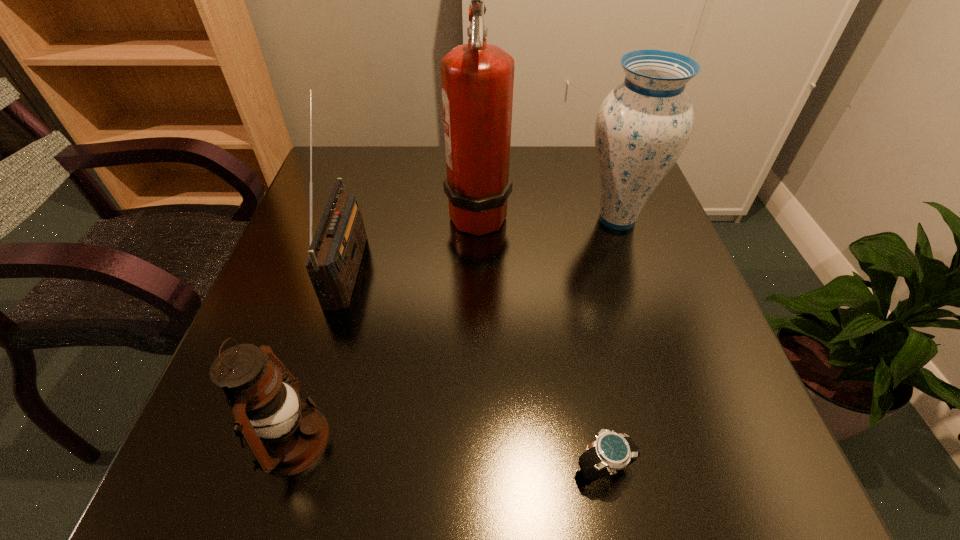
The image size is (960, 540). Identify the location of object present at the far right corner. (643, 125).

The image size is (960, 540). In the image, there is a desktop. Identify the location of vacant space at the far edge. (525, 154).

Locate an element on the screen. The height and width of the screenshot is (540, 960). vacant space at the near edge of the desktop is located at coordinates (615, 491).

In the image, there is a desktop. Where is `free region at the right edge`? This screenshot has width=960, height=540. free region at the right edge is located at coordinates point(665,427).

Identify the location of vacant space at the far left corner. (372, 154).

Where is `free region at the near left corner of the desktop`? This screenshot has width=960, height=540. free region at the near left corner of the desktop is located at coordinates (257, 480).

Find the location of a particular element. The image size is (960, 540). empty space between the second shortest object and the fire extinguisher is located at coordinates (386, 326).

Where is `free space between the fire extinguisher and the rightmost object`? The height and width of the screenshot is (540, 960). free space between the fire extinguisher and the rightmost object is located at coordinates (547, 215).

You are a GUI agent. You are given a task and a screenshot of the screen. Output one action in this format:
    pyautogui.click(x=<x>, y=<y>)
    Task: Click on the vacant area that lies between the tallest object and the radio receiver
    The width and height of the screenshot is (960, 540).
    Given the screenshot: What is the action you would take?
    pyautogui.click(x=413, y=239)

I want to click on vacant area between the radio receiver and the third object from left to right, so click(413, 239).